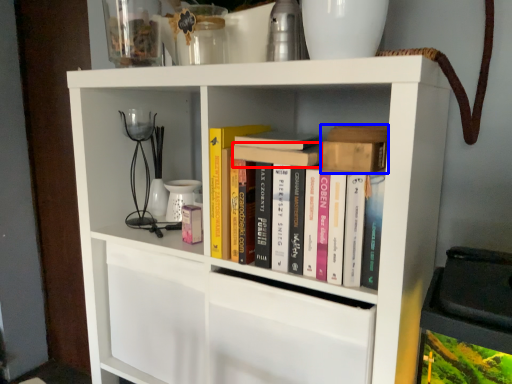
Question: Which point is further to the camera, book (highlighted by a red box) or book (highlighted by a blue box)?

Choices:
 (A) book
 (B) book

Answer: (A)